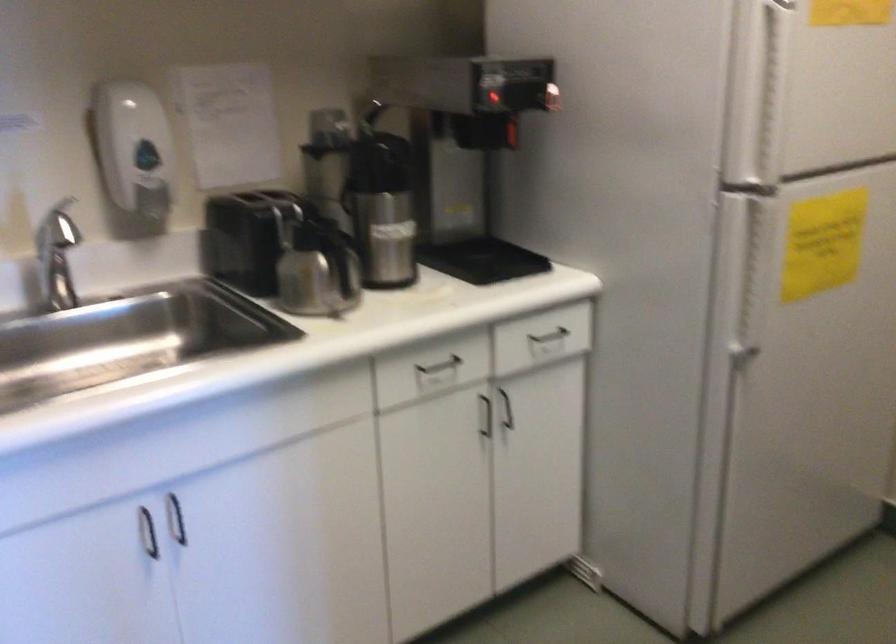
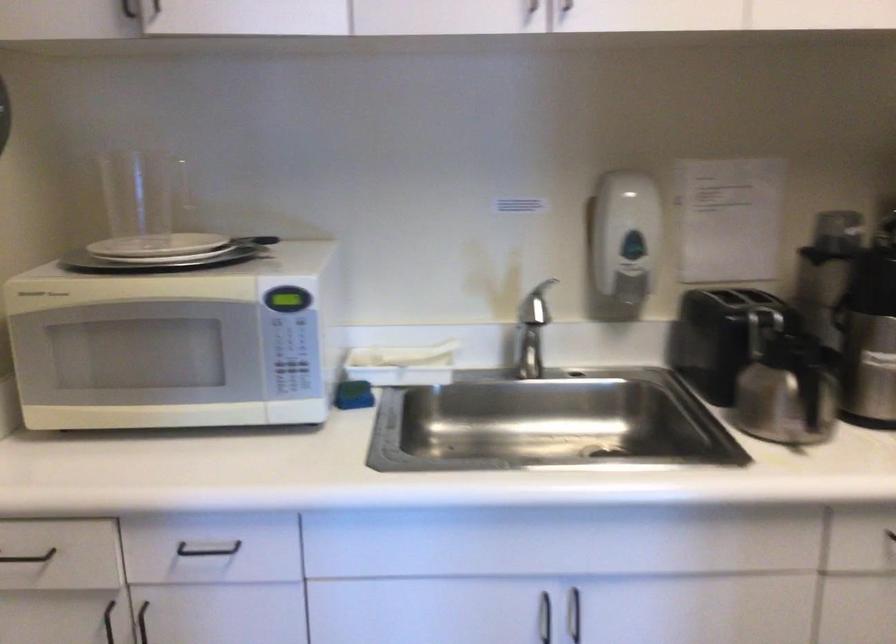
Locate, in the second image, the point that corresponds to point (157, 202) in the first image.

(631, 288)